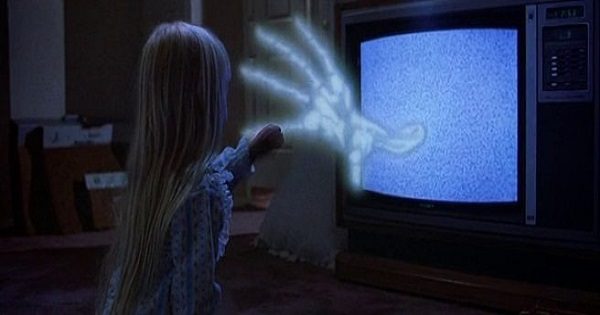
Identify the location of black outline of tv. The image size is (600, 315). (520, 102).